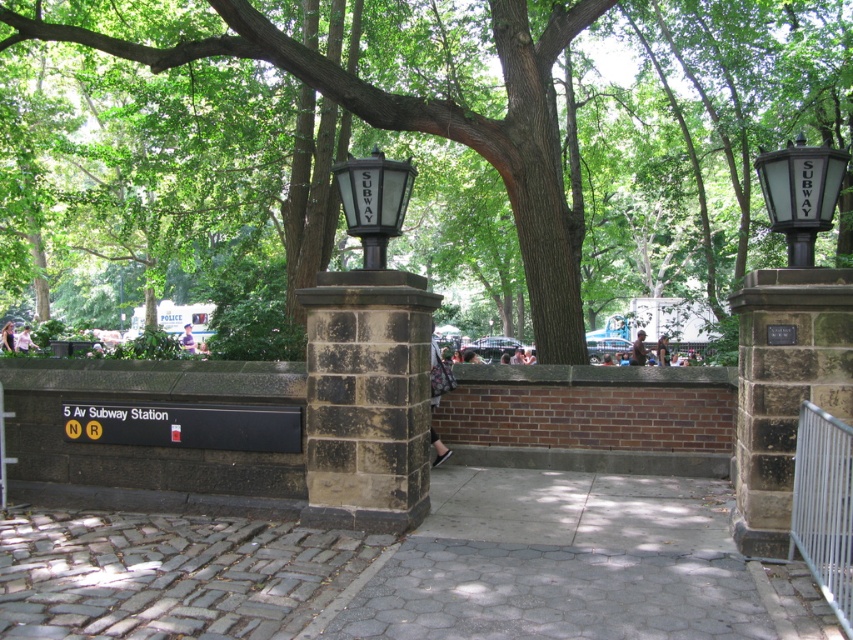
Is point (187, 257) farther from camera compared to point (488, 320)?

No.

At what (x,y) coordinates should I click in order to perform the action: click on green leafy tree at center. Please return your answer as a coordinate pair (x, y). Looking at the image, I should click on (416, 144).

Between gray cobblestone pavement at center and matte black lamp post at center, which one is positioned higher?

matte black lamp post at center is higher up.

What do you see at coordinates (416, 568) in the screenshot? I see `gray cobblestone pavement at center` at bounding box center [416, 568].

This screenshot has width=853, height=640. Find the location of `gray cobblestone pavement at center`. gray cobblestone pavement at center is located at coordinates (416, 568).

Image resolution: width=853 pixels, height=640 pixels. What do you see at coordinates (416, 568) in the screenshot? I see `gray cobblestone pavement at center` at bounding box center [416, 568].

Is point (412, 560) more distant than point (490, 324)?

No.

Locate an element on the screen. gray cobblestone pavement at center is located at coordinates (416, 568).